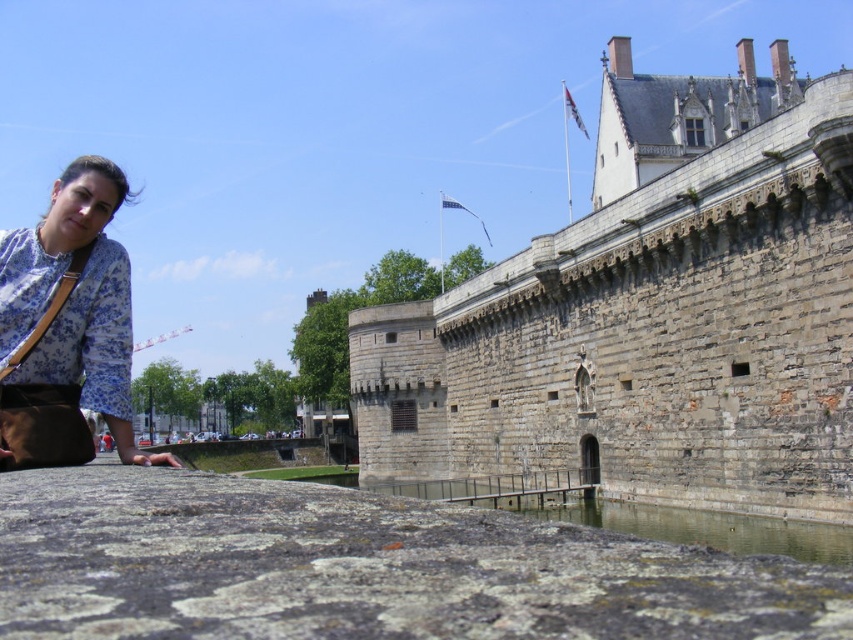
Question: Does gray stone castle at upper center lie in front of floral fabric blouse at lower left?

Choices:
 (A) yes
 (B) no

Answer: (B)

Question: In this image, where is gray stone castle at upper center located relative to floral fabric blouse at lower left?

Choices:
 (A) below
 (B) above

Answer: (B)

Question: Does gray stone castle at upper center have a greater width compared to floral fabric blouse at lower left?

Choices:
 (A) no
 (B) yes

Answer: (B)

Question: Among these objects, which one is nearest to the camera?

Choices:
 (A) floral fabric blouse at lower left
 (B) gray stone castle at upper center

Answer: (A)

Question: Which object appears closest to the camera in this image?

Choices:
 (A) floral fabric blouse at lower left
 (B) gray stone castle at upper center

Answer: (A)